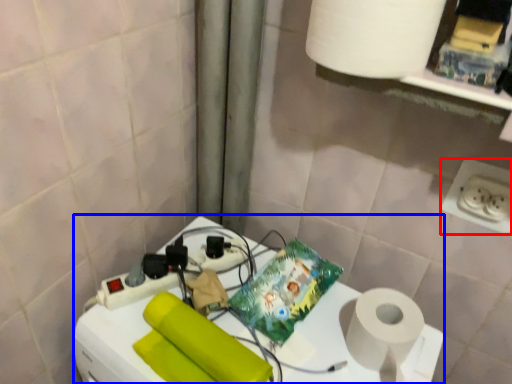
Question: Which object is closer to the camera taking this photo, power plugs and sockets (highlighted by a red box) or appliance (highlighted by a blue box)?

Choices:
 (A) power plugs and sockets
 (B) appliance

Answer: (B)